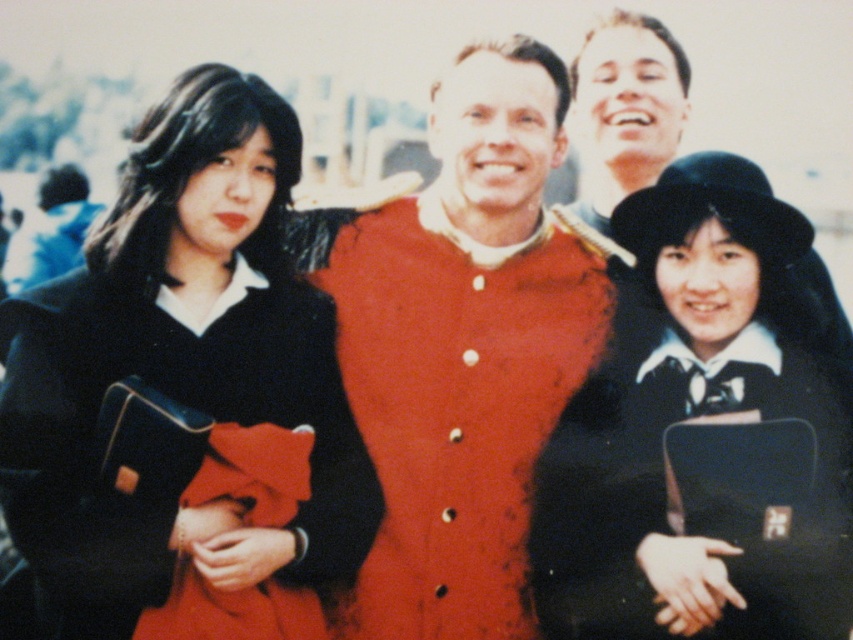
You are a photographer trying to decide which of the two red garments, the red leather jacket at center or the red wool coat at center, will show more detail in the photo. Which one do you think will have more visible texture?

The red leather jacket at center is thinner than the red wool coat at center, so the red leather jacket at center will have more visible texture because thinner materials often show texture more clearly.

Looking at this image, you are a photographer trying to capture a closeup of the black matte hat at upper right and the red wool coat at center. Since you want to focus on the hat, which object should you move closer to the camera to ensure it appears larger in the photo?

To make the black matte hat at upper right appear larger in the photo, you should move it closer to the camera since it has a lesser width compared to the red wool coat at center.